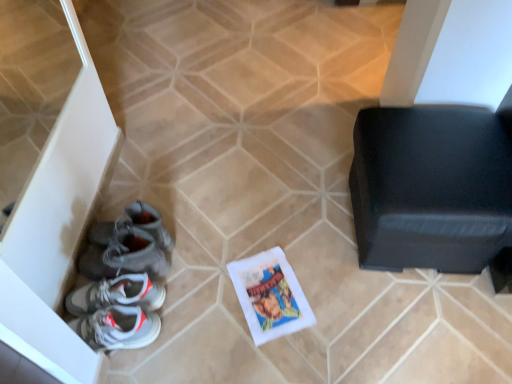
Image resolution: width=512 pixels, height=384 pixels. In order to click on vacant space that's between black leather ottoman at right and gray suede sneakers at lower left in this screenshot , I will do `click(264, 238)`.